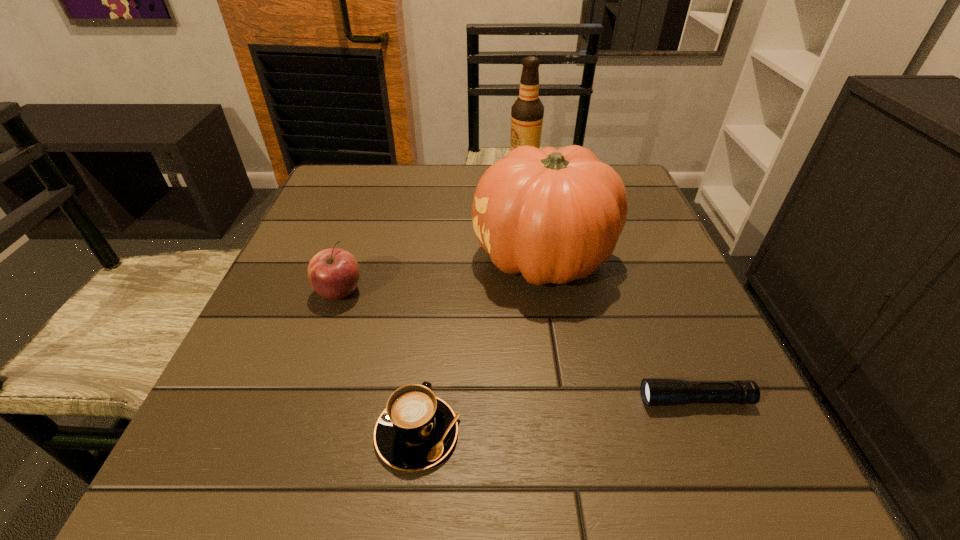
This screenshot has width=960, height=540. What are the coordinates of `vacant space positioned 0.280m on the label of the tallest object` in the screenshot? It's located at (401, 174).

Find the location of a particular element. This screenshot has height=540, width=960. vacant space situated 0.130m on the carved face of the pumpkin is located at coordinates (409, 259).

The height and width of the screenshot is (540, 960). I want to click on free spot located 0.310m on the carved face of the pumpkin, so click(x=322, y=259).

Find the location of `vacant space situated on the carved face of the pumpkin`. vacant space situated on the carved face of the pumpkin is located at coordinates (341, 259).

I want to click on vacant space located on the front of the apple, so click(308, 384).

Identify the location of free space located 0.240m on the back of the second object from left to right. (434, 287).

Find the location of a particular element. The image size is (960, 540). free location located 0.070m at the lens end of the flashlight is located at coordinates pos(595,400).

At what (x,y) coordinates should I click in order to perform the action: click on free spot located at the lens end of the flashlight. Please return your answer as a coordinate pair (x, y). Image resolution: width=960 pixels, height=540 pixels. Looking at the image, I should click on (474, 400).

This screenshot has height=540, width=960. Find the location of `vacant space located 0.050m at the lens end of the flashlight`. vacant space located 0.050m at the lens end of the flashlight is located at coordinates 609,400.

Locate an element on the screen. The height and width of the screenshot is (540, 960). object that is at the far edge is located at coordinates (527, 113).